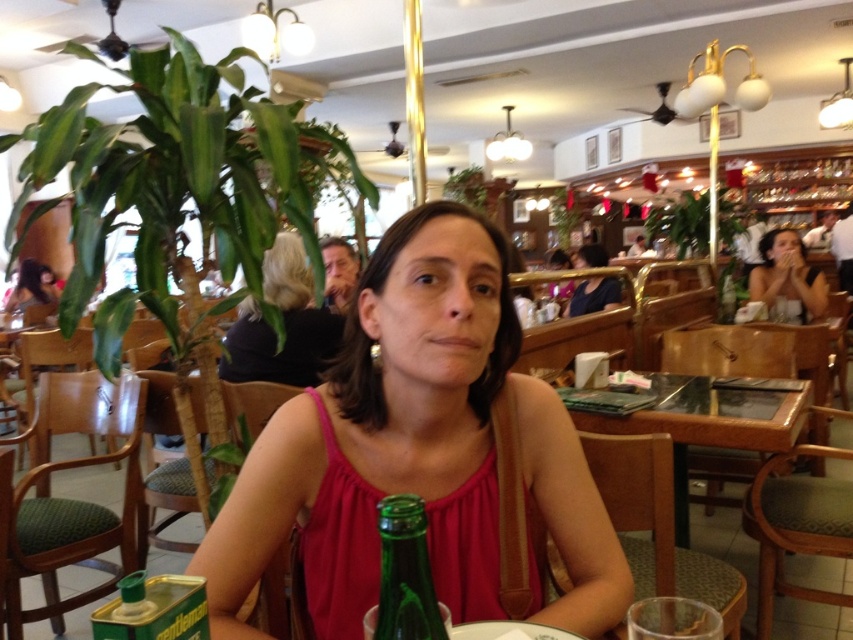
You are a photographer taking a picture of the scene. The dark brown hair at center is located at point [283,324]. If you want to focus on the dark brown hair at center, should you adjust your camera to the left or right of the current position?

The dark brown hair at center is already at the center point [283,324], so no adjustment is needed. The camera should remain at the current position to focus on it.